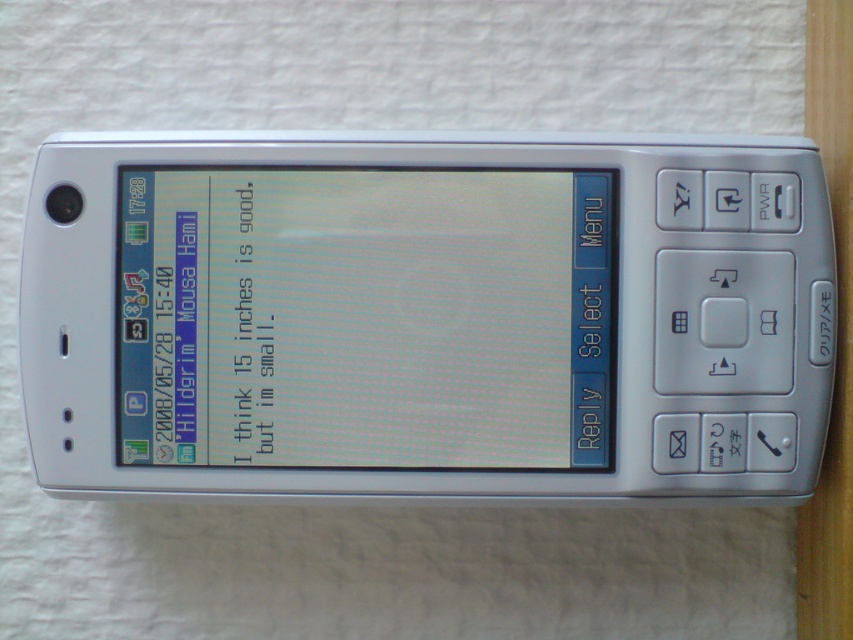
You are holding a silver metallic phone at center and looking at its matte plastic screen at center. If you want to place both items on a table, which one requires more space due to its size?

The silver metallic phone at center is bigger than the matte plastic screen at center, so it requires more space.

You are holding a silver metallic phone at center and a matte plastic screen at center. Which object is located more to the right side?

The silver metallic phone at center is positioned on the right side of matte plastic screen at center, so it is more to the right.

You are holding a map and see a silver metallic phone at center. According to the map coordinates, there is a point at (x=426, y=316). Is this point the location of the silver metallic phone at center?

Yes, the point at (x=426, y=316) indicates the silver metallic phone at center, so the coordinates match the phone.